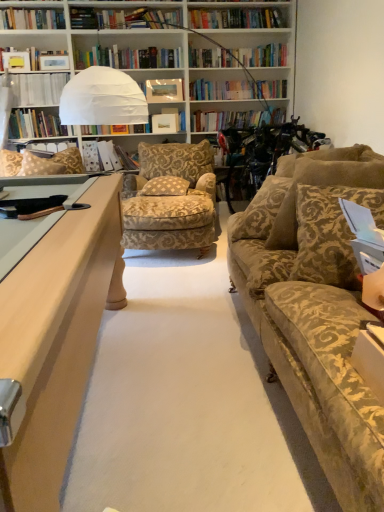
Question: Is matte white photo frame at center at the left side of brown textured pillow at right, the first pillow when ordered from right to left?

Choices:
 (A) yes
 (B) no

Answer: (A)

Question: Considering the relative sizes of matte white photo frame at center and brown textured pillow at right, the first pillow when ordered from right to left, in the image provided, is matte white photo frame at center taller than brown textured pillow at right, the first pillow when ordered from right to left,?

Choices:
 (A) no
 (B) yes

Answer: (A)

Question: From a real-world perspective, is matte white photo frame at center physically below brown textured pillow at right, the 3th pillow from the back?

Choices:
 (A) yes
 (B) no

Answer: (B)

Question: Does matte white photo frame at center have a lesser width compared to brown textured pillow at right, positioned as the fourth pillow in left-to-right order?

Choices:
 (A) yes
 (B) no

Answer: (A)

Question: Is the depth of matte white photo frame at center greater than that of brown textured pillow at right, which appears as the 2th pillow when viewed from the front?

Choices:
 (A) no
 (B) yes

Answer: (B)

Question: Looking at the image, does patterned fabric pillow at left, the 1th pillow in the back-to-front sequence, seem bigger or smaller compared to matte white folder at center, which appears as the 2th book when viewed from the top?

Choices:
 (A) big
 (B) small

Answer: (B)

Question: Would you say patterned fabric pillow at left, which is counted as the 4th pillow, starting from the front, is to the left or to the right of matte white folder at center, which ranks as the 1th book in bottom-to-top order, in the picture?

Choices:
 (A) left
 (B) right

Answer: (A)

Question: In the image, is patterned fabric pillow at left, the 1th pillow when ordered from left to right, positioned in front of or behind matte white folder at center, which ranks as the 1th book in bottom-to-top order?

Choices:
 (A) front
 (B) behind

Answer: (A)

Question: From the image's perspective, relative to matte white folder at center, which is counted as the 2th book, starting from the left, is patterned fabric pillow at left, the 1th pillow in the back-to-front sequence, above or below?

Choices:
 (A) above
 (B) below

Answer: (B)

Question: Is point (183, 192) positioned closer to the camera than point (119, 152)?

Choices:
 (A) farther
 (B) closer

Answer: (B)

Question: Considering their positions, is patterned fabric pillow at center, the 3th pillow viewed from the front, located in front of or behind matte white folder at center, which appears as the 2th book when viewed from the top?

Choices:
 (A) behind
 (B) front

Answer: (B)

Question: Considering the positions of patterned fabric pillow at center, the 3th pillow viewed from the front, and matte white folder at center, which ranks as the 1th book in right-to-left order, in the image, is patterned fabric pillow at center, the 3th pillow viewed from the front, bigger or smaller than matte white folder at center, which ranks as the 1th book in right-to-left order,?

Choices:
 (A) small
 (B) big

Answer: (A)

Question: From a real-world perspective, is patterned fabric pillow at center, arranged as the 2th pillow when viewed from the back, positioned above or below matte white folder at center, which ranks as the 1th book in right-to-left order?

Choices:
 (A) above
 (B) below

Answer: (B)

Question: Considering the positions of transparent plastic book at upper left, the second book in the right-to-left sequence, and patterned fabric pillow at center, the 3th pillow viewed from the front, in the image, is transparent plastic book at upper left, the second book in the right-to-left sequence, bigger or smaller than patterned fabric pillow at center, the 3th pillow viewed from the front,?

Choices:
 (A) big
 (B) small

Answer: (A)

Question: In the image, is transparent plastic book at upper left, which appears as the second book when ordered from the bottom, positioned in front of or behind patterned fabric pillow at center, the 3th pillow viewed from the front?

Choices:
 (A) behind
 (B) front

Answer: (A)